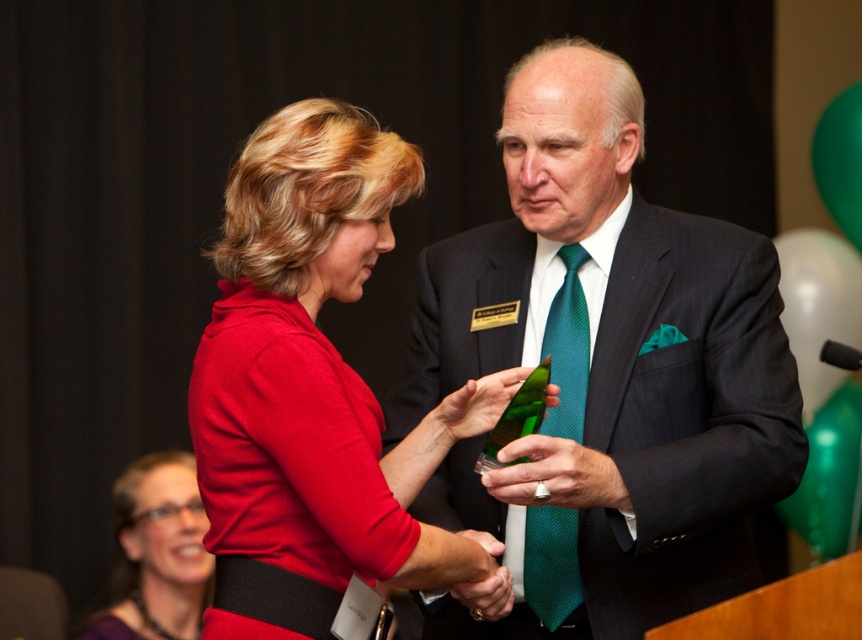
You are a photographer at the event and need to capture a closeup shot of both the matte red dress at center and the green silk tie at center. The camera you are using has a minimum focus distance of 16 inches. Can you take the photo without moving either object?

The distance between the matte red dress at center and green silk tie at center is 16.98 inches, which is slightly more than the camera minimum focus distance of 16 inches. Therefore, you can take the photo without moving either object.

You are a photographer at the event and need to ensure both the matte red dress at center and the purple fabric dress at lower left are visible in the photo. Based on their positions, which dress is closer to the camera?

The matte red dress at center is closer to the camera because it is in front of the purple fabric dress at lower left.